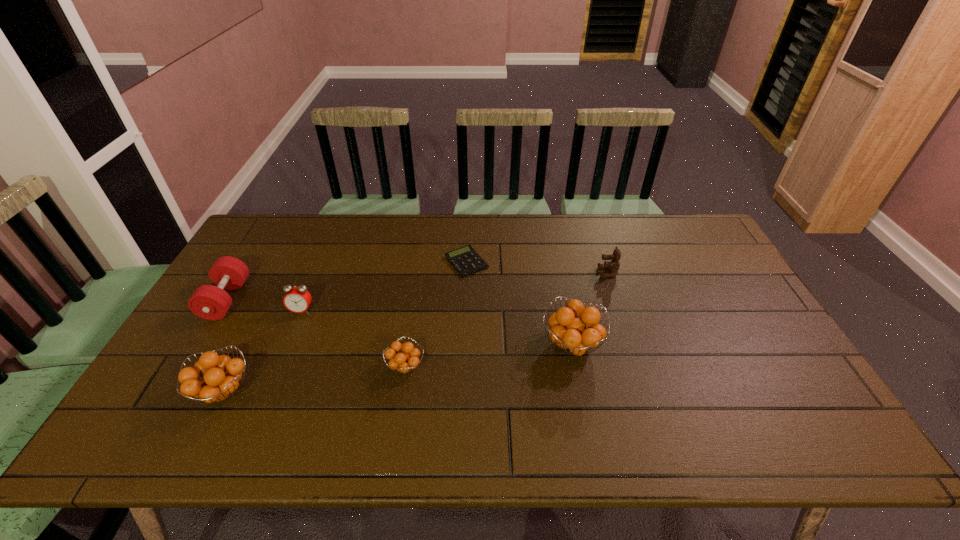
Locate an element on the screen. This screenshot has height=540, width=960. vacant place for an extra orange fruit on the right is located at coordinates (724, 325).